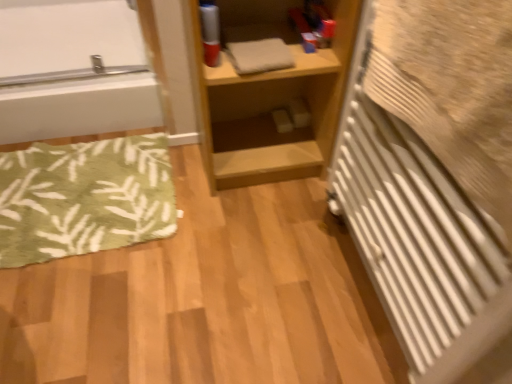
Question: From a real-world perspective, is light wood shelf at center under white glossy bathtub at upper left?

Choices:
 (A) no
 (B) yes

Answer: (A)

Question: From the image's perspective, is light wood shelf at center located beneath white glossy bathtub at upper left?

Choices:
 (A) no
 (B) yes

Answer: (B)

Question: Is light wood shelf at center not within white glossy bathtub at upper left?

Choices:
 (A) yes
 (B) no

Answer: (A)

Question: Would you say white glossy bathtub at upper left is part of light wood shelf at center's contents?

Choices:
 (A) no
 (B) yes

Answer: (A)

Question: Can you confirm if light wood shelf at center is positioned to the right of white glossy bathtub at upper left?

Choices:
 (A) no
 (B) yes

Answer: (B)

Question: Is light wood shelf at center further to camera compared to white glossy bathtub at upper left?

Choices:
 (A) no
 (B) yes

Answer: (A)

Question: Considering the relative positions of white textured radiator at right and white glossy bathtub at upper left in the image provided, is white textured radiator at right in front of white glossy bathtub at upper left?

Choices:
 (A) no
 (B) yes

Answer: (B)

Question: Considering the relative positions of white textured radiator at right and white glossy bathtub at upper left in the image provided, is white textured radiator at right to the left of white glossy bathtub at upper left from the viewer's perspective?

Choices:
 (A) yes
 (B) no

Answer: (B)

Question: Can you confirm if white textured radiator at right is positioned to the right of white glossy bathtub at upper left?

Choices:
 (A) no
 (B) yes

Answer: (B)

Question: Does white textured radiator at right have a greater height compared to white glossy bathtub at upper left?

Choices:
 (A) yes
 (B) no

Answer: (A)

Question: Does white textured radiator at right have a larger size compared to white glossy bathtub at upper left?

Choices:
 (A) yes
 (B) no

Answer: (B)

Question: Would you say white glossy bathtub at upper left is part of white textured radiator at right's contents?

Choices:
 (A) yes
 (B) no

Answer: (B)

Question: Is white glossy bathtub at upper left looking in the opposite direction of light wood shelf at center?

Choices:
 (A) yes
 (B) no

Answer: (B)